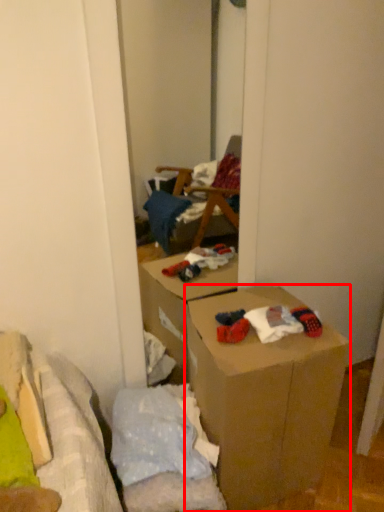
Question: Where is box (annotated by the red box) located in relation to toy in the image?

Choices:
 (A) right
 (B) left

Answer: (B)